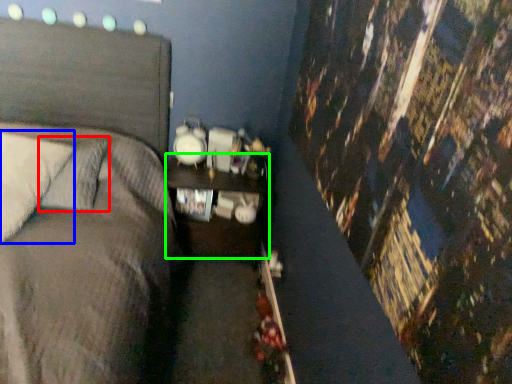
Question: Which object is positioned farthest from pillow (highlighted by a red box)? Select from pillow (highlighted by a blue box) and nightstand (highlighted by a green box).

Choices:
 (A) pillow
 (B) nightstand

Answer: (B)